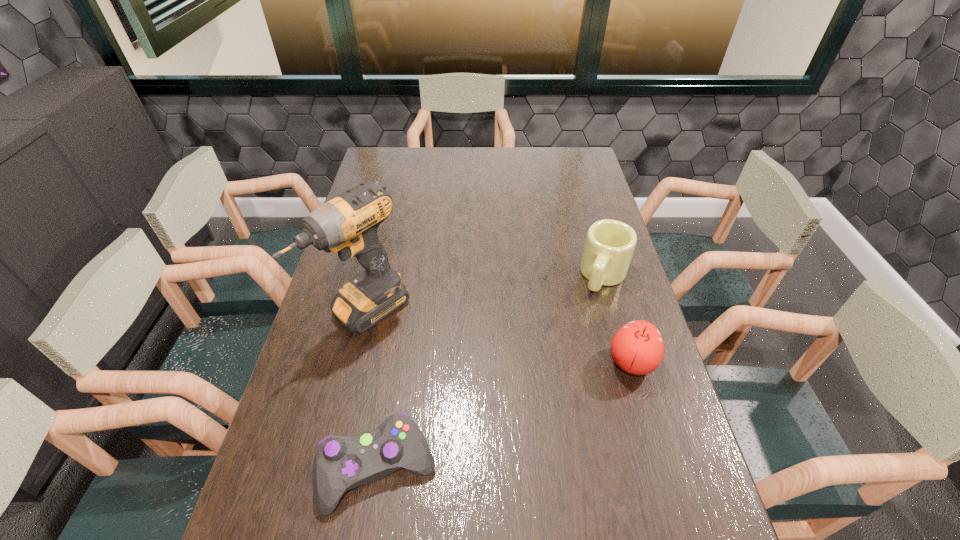
This screenshot has width=960, height=540. Find the location of `free space on the desktop that is between the control and the apple and is positioned with the drill bit of the tallest object facing forward`. free space on the desktop that is between the control and the apple and is positioned with the drill bit of the tallest object facing forward is located at coordinates pyautogui.click(x=494, y=420).

You are a GUI agent. You are given a task and a screenshot of the screen. Output one action in this format:
    pyautogui.click(x=<x>, y=<y>)
    Task: Click on the vacant space on the desktop that is between the nearest object and the apple and is positioned with the handle on the side of the mug
    
    Given the screenshot: What is the action you would take?
    pyautogui.click(x=551, y=396)